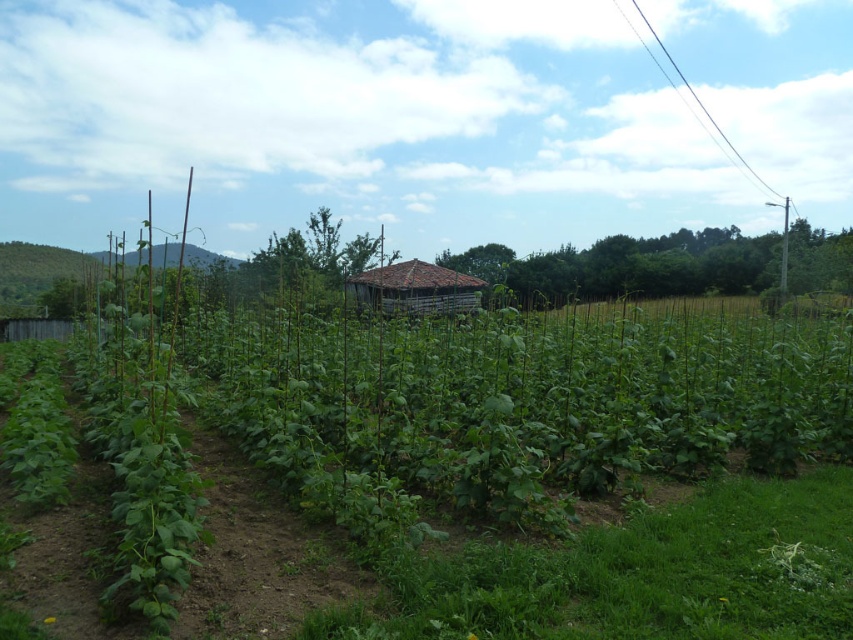
Does green leafy plants at center appear on the left side of brown wooden hut at center?

In fact, green leafy plants at center is to the right of brown wooden hut at center.

Can you confirm if green leafy plants at center is taller than brown wooden hut at center?

Yes, green leafy plants at center is taller than brown wooden hut at center.

You are a GUI agent. You are given a task and a screenshot of the screen. Output one action in this format:
    pyautogui.click(x=<x>, y=<y>)
    Task: Click on the green leafy plants at center
    The width and height of the screenshot is (853, 640).
    Given the screenshot: What is the action you would take?
    pyautogui.click(x=437, y=404)